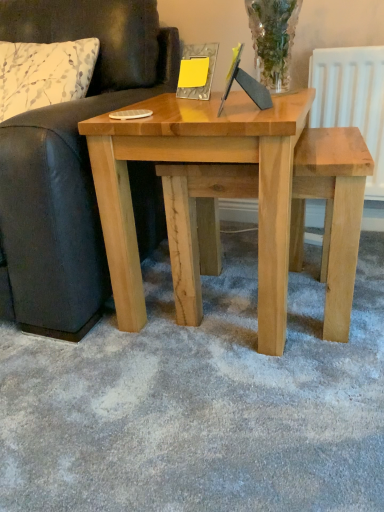
Question: From a real-world perspective, is natural wood table at center physically below white floral fabric pillow at left?

Choices:
 (A) no
 (B) yes

Answer: (B)

Question: From the image's perspective, would you say natural wood table at center is shown under white floral fabric pillow at left?

Choices:
 (A) no
 (B) yes

Answer: (B)

Question: Is natural wood table at center shorter than white floral fabric pillow at left?

Choices:
 (A) no
 (B) yes

Answer: (A)

Question: Does natural wood table at center have a lesser width compared to white floral fabric pillow at left?

Choices:
 (A) yes
 (B) no

Answer: (B)

Question: Does natural wood table at center lie behind white floral fabric pillow at left?

Choices:
 (A) no
 (B) yes

Answer: (A)

Question: Considering their positions, is white floral fabric pillow at left located in front of or behind natural wood table at center?

Choices:
 (A) front
 (B) behind

Answer: (B)

Question: From a real-world perspective, is white floral fabric pillow at left positioned above or below natural wood table at center?

Choices:
 (A) below
 (B) above

Answer: (B)

Question: From the image's perspective, relative to natural wood table at center, is white floral fabric pillow at left above or below?

Choices:
 (A) below
 (B) above

Answer: (B)

Question: In terms of height, does white floral fabric pillow at left look taller or shorter compared to natural wood table at center?

Choices:
 (A) tall
 (B) short

Answer: (B)

Question: In terms of width, does white floral fabric pillow at left look wider or thinner when compared to leather couch at left?

Choices:
 (A) wide
 (B) thin

Answer: (B)

Question: Does point click(33, 66) appear closer or farther from the camera than point click(115, 89)?

Choices:
 (A) farther
 (B) closer

Answer: (B)

Question: Would you say white floral fabric pillow at left is inside or outside leather couch at left?

Choices:
 (A) inside
 (B) outside

Answer: (A)

Question: Considering the positions of white floral fabric pillow at left and leather couch at left in the image, is white floral fabric pillow at left taller or shorter than leather couch at left?

Choices:
 (A) short
 (B) tall

Answer: (A)

Question: Is natural wood table at center bigger or smaller than leather couch at left?

Choices:
 (A) small
 (B) big

Answer: (A)

Question: Is natural wood table at center situated inside leather couch at left or outside?

Choices:
 (A) outside
 (B) inside

Answer: (A)